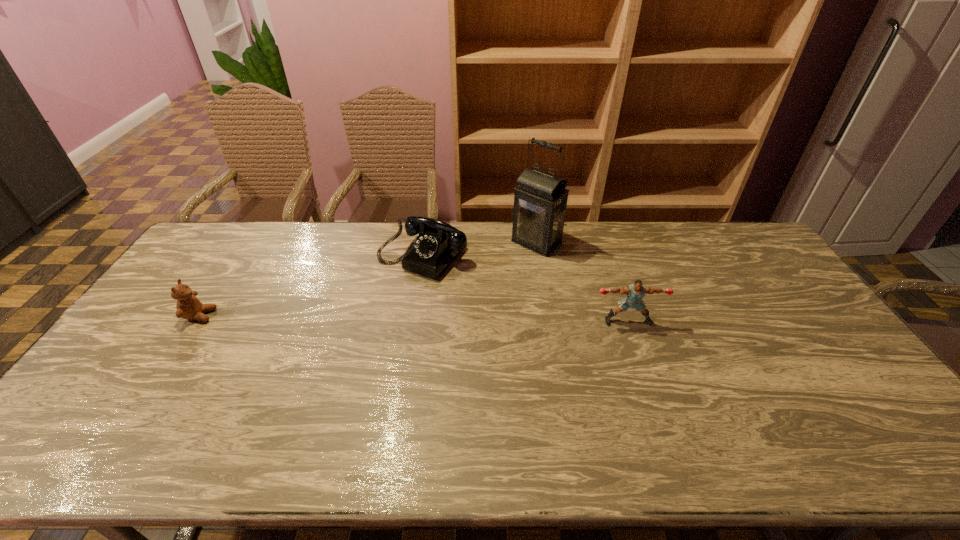
I want to click on free spot located 0.330m on the dial of the telephone, so click(330, 348).

Find the location of `free space located 0.390m on the front-facing side of the lantern`. free space located 0.390m on the front-facing side of the lantern is located at coordinates (448, 316).

This screenshot has width=960, height=540. Identify the location of vacant area situated 0.090m on the front-facing side of the lantern. (507, 267).

Locate an element on the screen. The width and height of the screenshot is (960, 540). vacant space located 0.220m on the front-facing side of the lantern is located at coordinates (483, 287).

You are a GUI agent. You are given a task and a screenshot of the screen. Output one action in this format:
    pyautogui.click(x=<x>, y=<y>)
    Task: Click on the telephone that is at the far edge
    
    Given the screenshot: What is the action you would take?
    pyautogui.click(x=438, y=243)

At what (x,y) coordinates should I click in order to perform the action: click on lantern that is positioned at the far edge. Please return your answer as a coordinate pair (x, y). This screenshot has height=540, width=960. Looking at the image, I should click on [540, 199].

Locate an element on the screen. The width and height of the screenshot is (960, 540). object that is positioned at the left edge is located at coordinates (188, 306).

This screenshot has width=960, height=540. Find the location of `free space at the far edge of the desktop`. free space at the far edge of the desktop is located at coordinates (261, 251).

In the image, there is a desktop. In order to click on free space at the near edge in this screenshot , I will do `click(748, 401)`.

Find the location of a particular element. free space at the left edge of the desktop is located at coordinates (209, 272).